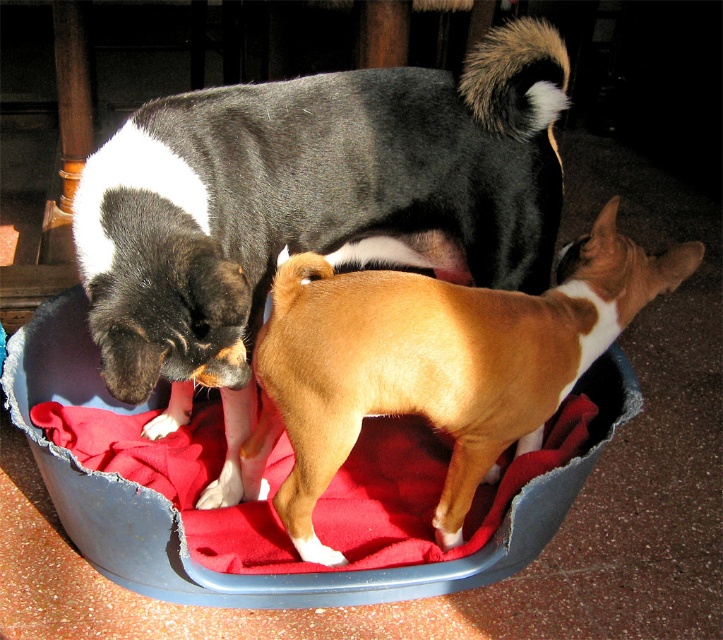
Is point (356, 371) farther from camera compared to point (116, 516)?

No, (356, 371) is in front of (116, 516).

Where is `brown smooth dog at center`? This screenshot has height=640, width=723. brown smooth dog at center is located at coordinates (435, 364).

Is black and white fur at upper left closer to camera compared to brown smooth dog at center?

Yes, it is in front of brown smooth dog at center.

Is point (432, 100) in front of point (607, 310)?

No, (432, 100) is behind (607, 310).

Who is more forward, (312, 172) or (390, 280)?

Point (390, 280) is more forward.

At what (x,y) coordinates should I click in order to perform the action: click on black and white fur at upper left. Please return your answer as a coordinate pair (x, y). Looking at the image, I should click on (309, 205).

Who is shorter, black and white fur at upper left or blue fabric dog bed at center?

With less height is blue fabric dog bed at center.

Find the location of a particular element. Image resolution: width=723 pixels, height=640 pixels. black and white fur at upper left is located at coordinates (309, 205).

I want to click on black and white fur at upper left, so click(309, 205).